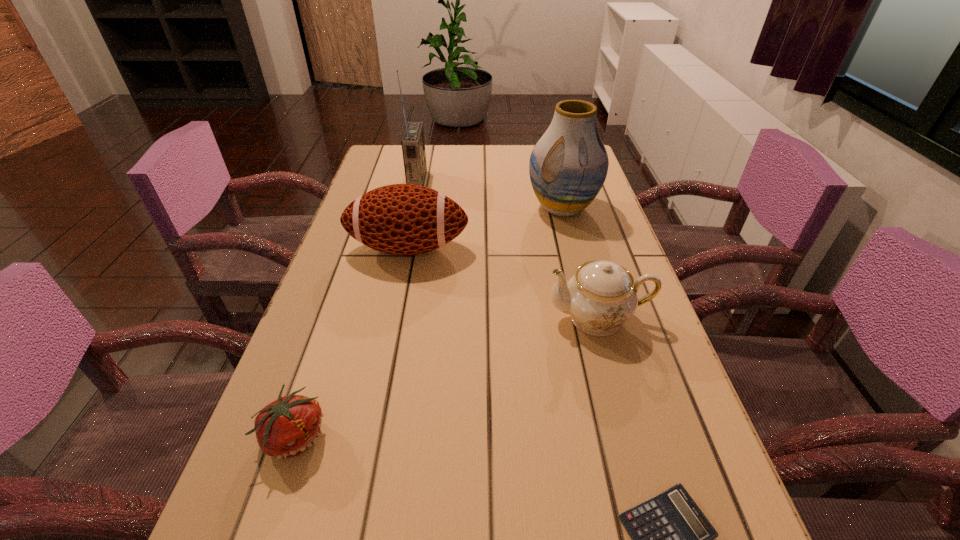
Locate an element on the screen. free location located 0.400m at the spout of the third shortest object is located at coordinates (358, 318).

Locate an element on the screen. free spot located 0.400m at the spout of the third shortest object is located at coordinates (358, 318).

Where is `vacant region located at the spout of the third shortest object`? The width and height of the screenshot is (960, 540). vacant region located at the spout of the third shortest object is located at coordinates (429, 318).

Identify the location of free region located on the right of the second nearest object. Image resolution: width=960 pixels, height=540 pixels. (532, 435).

Identify the location of object at the far edge. The width and height of the screenshot is (960, 540). (413, 144).

This screenshot has width=960, height=540. What are the coordinates of `radio receiver located at the left edge` in the screenshot? It's located at point(413,144).

The width and height of the screenshot is (960, 540). I want to click on football at the left edge, so click(400, 219).

Where is `tomato at the left edge`? tomato at the left edge is located at coordinates (287, 427).

Locate an element on the screen. vase present at the right edge is located at coordinates (568, 166).

In order to click on chinaware positioned at the right edge in this screenshot , I will do `click(602, 296)`.